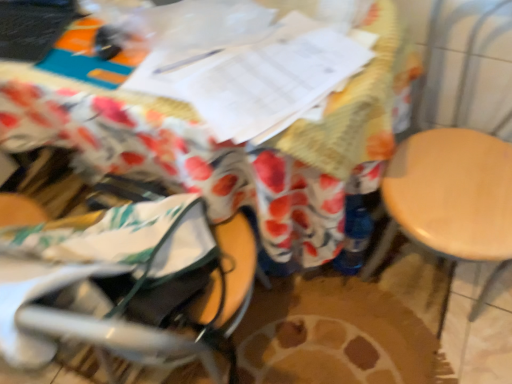
Question: Does gray fabric baby carriage at lower left have a greater width compared to wooden table at center?

Choices:
 (A) yes
 (B) no

Answer: (B)

Question: Is gray fabric baby carriage at lower left completely or partially outside of wooden table at center?

Choices:
 (A) yes
 (B) no

Answer: (A)

Question: Considering the relative sizes of gray fabric baby carriage at lower left and wooden table at center in the image provided, is gray fabric baby carriage at lower left taller than wooden table at center?

Choices:
 (A) no
 (B) yes

Answer: (A)

Question: Does gray fabric baby carriage at lower left turn towards wooden table at center?

Choices:
 (A) no
 (B) yes

Answer: (B)

Question: Considering the relative sizes of gray fabric baby carriage at lower left and wooden table at center in the image provided, is gray fabric baby carriage at lower left shorter than wooden table at center?

Choices:
 (A) yes
 (B) no

Answer: (A)

Question: Is the surface of gray fabric baby carriage at lower left in direct contact with wooden table at center?

Choices:
 (A) no
 (B) yes

Answer: (A)

Question: Is light wood swivel chair at right next to gray fabric baby carriage at lower left and touching it?

Choices:
 (A) yes
 (B) no

Answer: (B)

Question: Is light wood swivel chair at right shorter than gray fabric baby carriage at lower left?

Choices:
 (A) yes
 (B) no

Answer: (B)

Question: From the image's perspective, is light wood swivel chair at right above gray fabric baby carriage at lower left?

Choices:
 (A) yes
 (B) no

Answer: (A)

Question: Is light wood swivel chair at right at the left side of gray fabric baby carriage at lower left?

Choices:
 (A) yes
 (B) no

Answer: (B)

Question: Is light wood swivel chair at right looking in the opposite direction of gray fabric baby carriage at lower left?

Choices:
 (A) no
 (B) yes

Answer: (A)

Question: Is light wood swivel chair at right smaller than gray fabric baby carriage at lower left?

Choices:
 (A) no
 (B) yes

Answer: (A)

Question: Would you say wooden table at center contains light wood swivel chair at right?

Choices:
 (A) no
 (B) yes

Answer: (A)